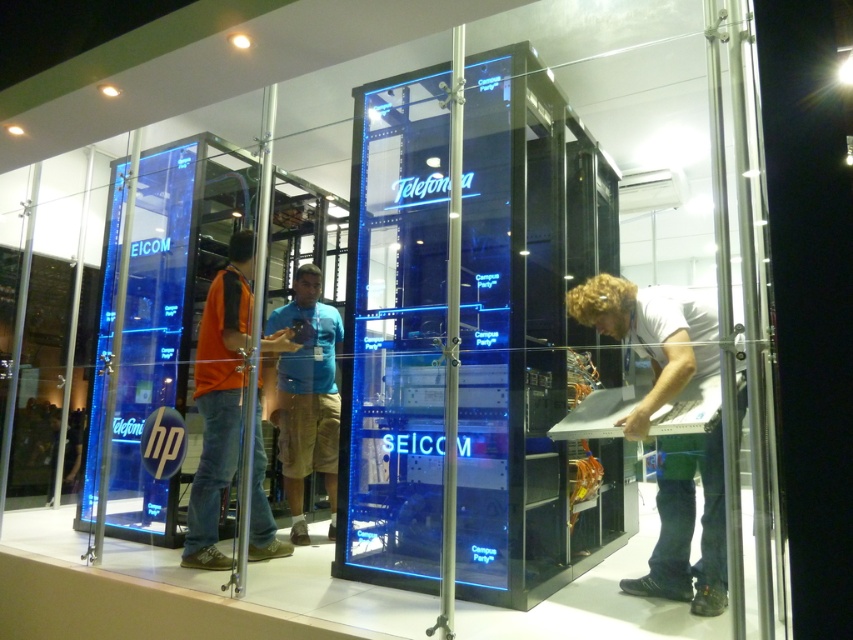
You are a photographer at the exhibition and want to capture a photo that includes both the white matte shirt at center and the blue fabric shirt at center. Based on their positions, which shirt should you focus on first to ensure both are in frame?

The white matte shirt at center is located above the blue fabric shirt at center, so focusing on the white matte shirt at center first will ensure both are in frame as the blue fabric shirt at center is below it.

You are a photographer at the exhibition and want to capture a photo of both the white matte shirt at center and the blue fabric shirt at center without any overlap. Given their positions, is it possible to frame them side by side in the same shot?

The white matte shirt at center might be wider than blue fabric shirt at center, so it is possible to frame them side by side in the same shot without overlap as long as there is sufficient space between them.

You are a photographer at the exhibition and want to ensure that both the white matte shirt at center and the orange fabric shirt at center are fully visible in your photo. Given that the camera lens can only focus on objects up to 1.8 meters in height, will both shirts be fully captured?

The white matte shirt at center is shorter than the orange fabric shirt at center. Since the camera lens can focus up to 1.8 meters, both shirts will be fully captured as long as their heights are within this limit. However, without specific height measurements, we can only confirm that the shorter white matte shirt at center will definitely be within the limit. The orange fabric shirt at center may or may not exceed 1.8 meters depending on its actual height.